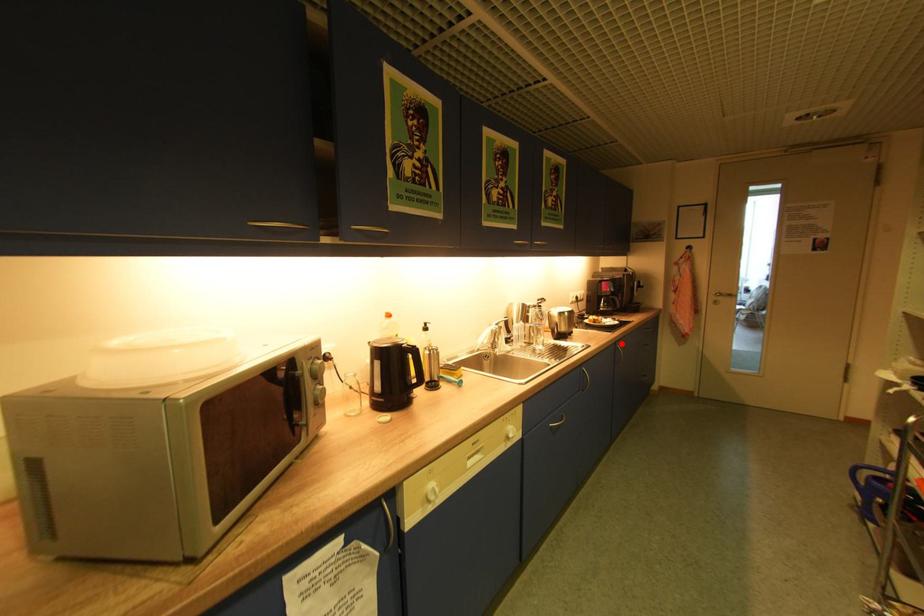
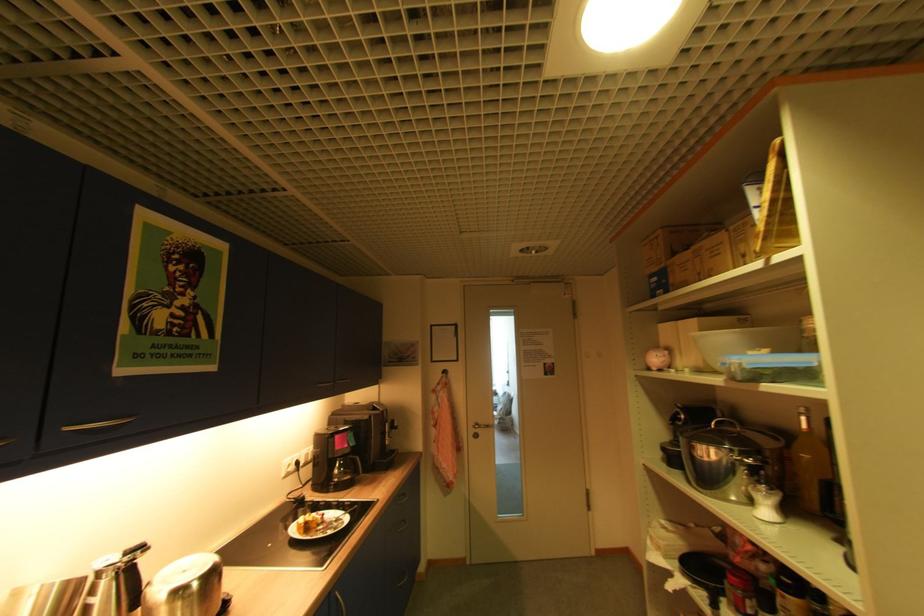
Question: A red point is marked in image1. In image2, is the corresponding 3D point closer to the camera or farther? Reply with the corresponding letter.

Choices:
 (A) The corresponding 3D point is closer.
 (B) The corresponding 3D point is farther.

Answer: (A)